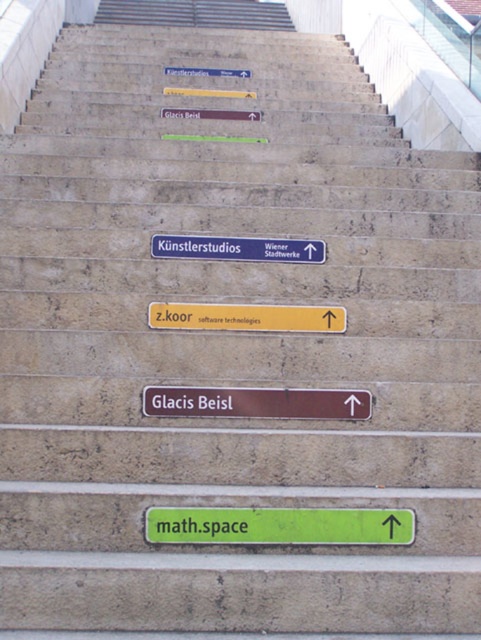
You are standing on the stone steps and see the blue plastic sign at center and the matte brown sign at center. Which one is positioned more to the right side?

The blue plastic sign at center is positioned to the right of the matte brown sign at center, so it is more to the right.